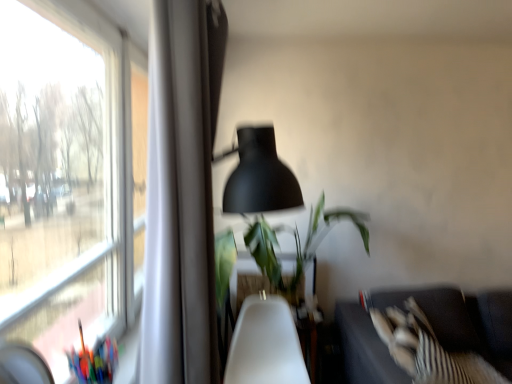
Question: In terms of width, does green leafy plant at center look wider or thinner when compared to white plastic swivel chair at center?

Choices:
 (A) wide
 (B) thin

Answer: (A)

Question: From the image's perspective, is green leafy plant at center above or below white plastic swivel chair at center?

Choices:
 (A) above
 (B) below

Answer: (A)

Question: Estimate the real-world distances between objects in this image. Which object is closer to the dark gray fabric couch at lower right?

Choices:
 (A) matte black lampshade at center
 (B) green leafy plant at center
 (C) white plastic swivel chair at center

Answer: (C)

Question: Based on their relative distances, which object is farther from the dark gray fabric couch at lower right?

Choices:
 (A) green leafy plant at center
 (B) white plastic swivel chair at center
 (C) matte black lampshade at center

Answer: (C)